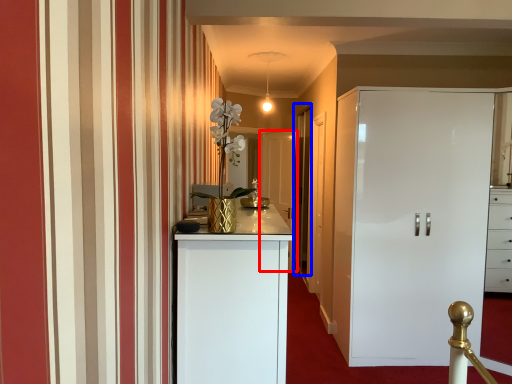
Question: Among these objects, which one is nearest to the camera, door (highlighted by a red box) or glass door (highlighted by a blue box)?

Choices:
 (A) door
 (B) glass door

Answer: (B)